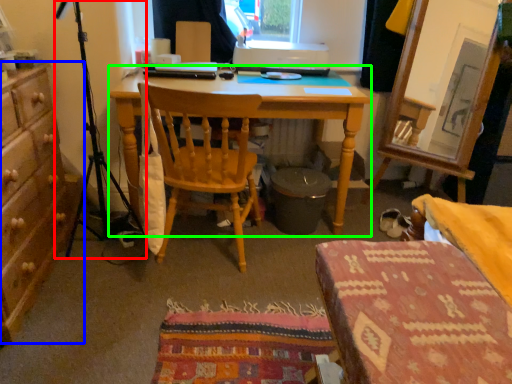
Question: Which is nearer to the tripod (highlighted by a red box)? cabinetry (highlighted by a blue box) or desk (highlighted by a green box).

Choices:
 (A) cabinetry
 (B) desk

Answer: (A)